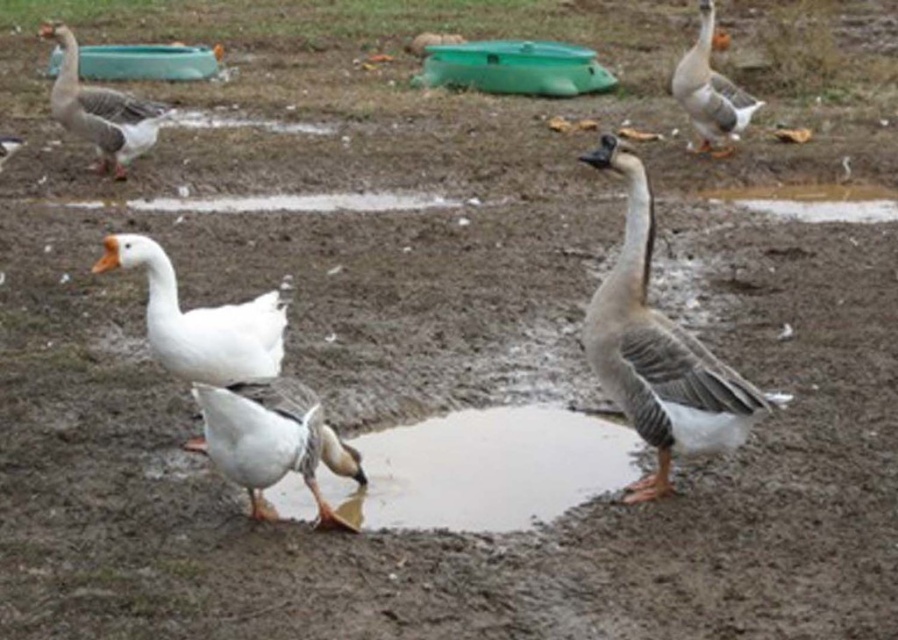
Question: Which of the following is the farthest from the observer?

Choices:
 (A) gray matte duck at center
 (B) white matte duck at lower center
 (C) shiny mud puddle at center

Answer: (C)

Question: Does gray matte duck at center lie behind gray matte goose at upper left?

Choices:
 (A) no
 (B) yes

Answer: (A)

Question: Does white matte duck at lower center appear over gray matte goose at upper left?

Choices:
 (A) no
 (B) yes

Answer: (A)

Question: Which point is closer to the camera?

Choices:
 (A) shiny mud puddle at center
 (B) white matte duck at lower center

Answer: (B)

Question: Which object is farther from the camera taking this photo?

Choices:
 (A) white matte duck at lower center
 (B) gray matte duck at center
 (C) white matte goose at center

Answer: (C)

Question: Is gray matte duck at center to the left of white matte goose at center from the viewer's perspective?

Choices:
 (A) yes
 (B) no

Answer: (B)